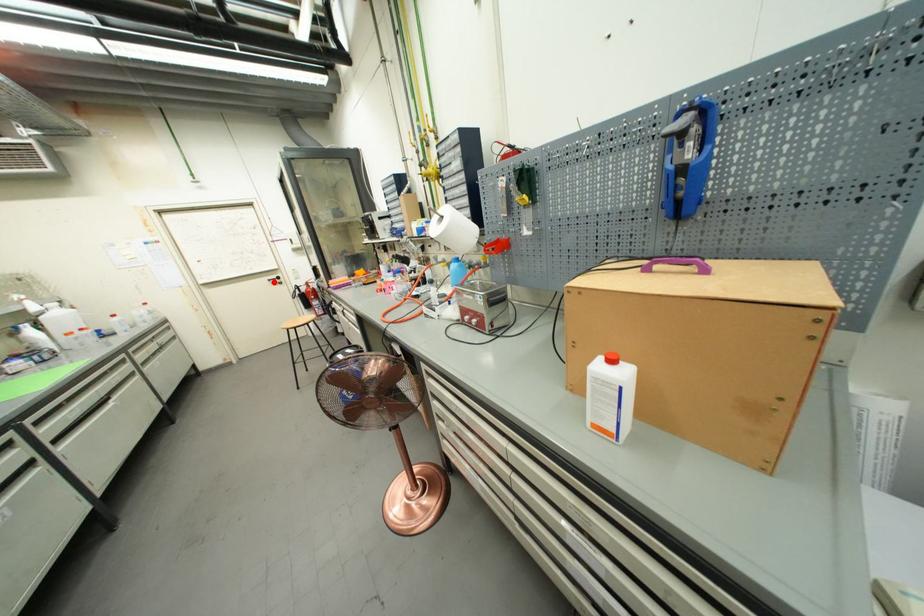
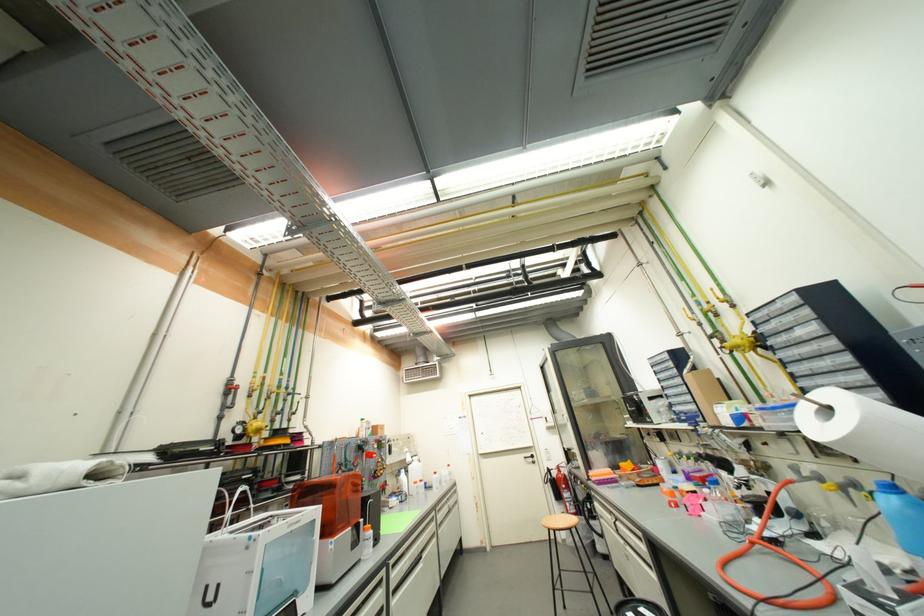
In the second image, find the point that corresponds to the highlighted location in the first image.

(530, 459)